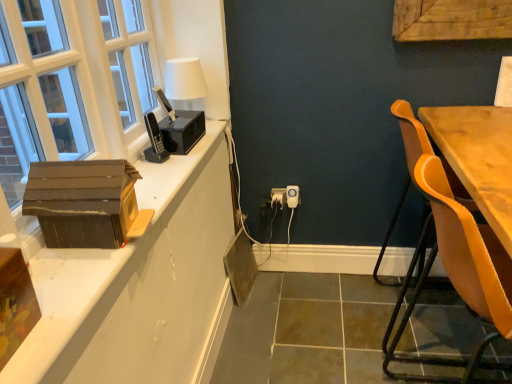
Where is `space that is in front of brown cardboard box at left, the second cardboard box in the front-to-back sequence`? space that is in front of brown cardboard box at left, the second cardboard box in the front-to-back sequence is located at coordinates (76, 278).